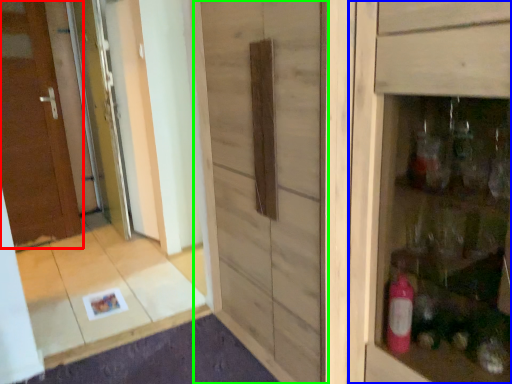
Question: Considering the real-world distances, which object is closest to door (highlighted by a red box)? cabinetry (highlighted by a blue box) or barn door (highlighted by a green box).

Choices:
 (A) cabinetry
 (B) barn door

Answer: (B)